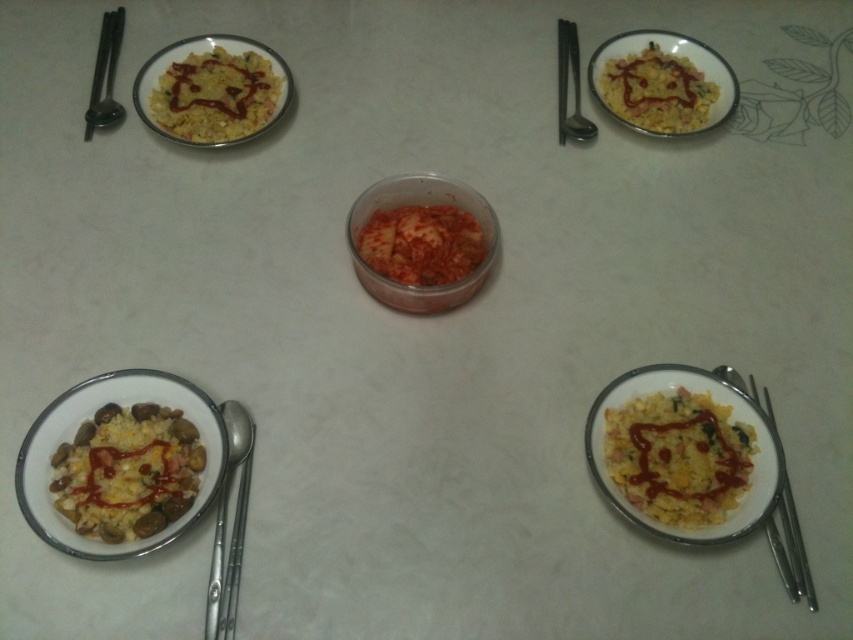
Who is lower down, yellow rice with mixed ingredients at bottom left or slightly translucent red kimchi at center?

yellow rice with mixed ingredients at bottom left

Is yellow rice with mixed ingredients at bottom left bigger than slightly translucent red kimchi at center?

No.

Between point (79, 476) and point (368, 237), which one is positioned in front?

Point (79, 476) is in front.

Locate an element on the screen. yellow rice with mixed ingredients at bottom left is located at coordinates (126, 472).

Is yellow rice with mixed ingredients at bottom left in front of yellow matte rice at upper right?

Yes, it is.

Does yellow rice with mixed ingredients at bottom left appear under yellow matte rice at upper right?

Yes.

Locate an element on the screen. The width and height of the screenshot is (853, 640). yellow rice with mixed ingredients at bottom left is located at coordinates (126, 472).

What do you see at coordinates (231, 525) in the screenshot? I see `silver metallic spoon at lower left` at bounding box center [231, 525].

Does silver metallic spoon at lower left have a greater width compared to satin silver spoon at upper center?

No, silver metallic spoon at lower left is not wider than satin silver spoon at upper center.

I want to click on silver metallic spoon at lower left, so click(x=231, y=525).